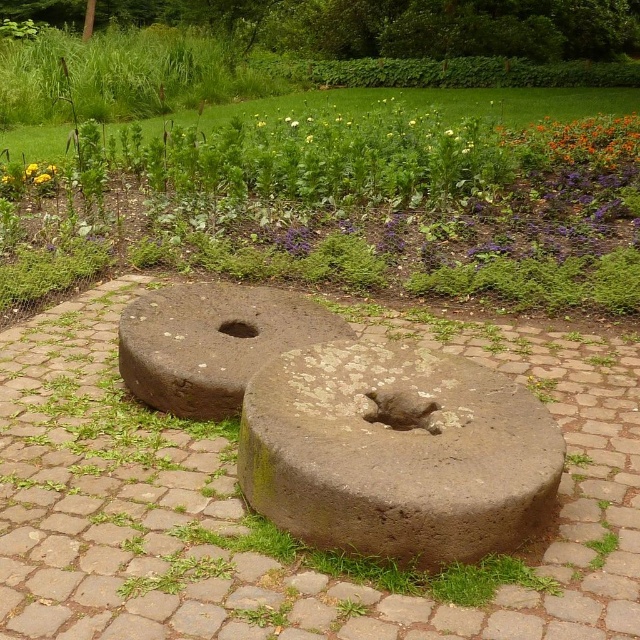
Which is in front, point (509, 163) or point (552, 452)?

Positioned in front is point (552, 452).

I want to click on green mossy stone at center, so click(x=349, y=205).

Is gray rough stone at center closer to the viewer compared to brown stone hole at center?

Yes, gray rough stone at center is in front of brown stone hole at center.

Is gray rough stone at center above brown stone hole at center?

Actually, gray rough stone at center is below brown stone hole at center.

Is point (435, 401) less distant than point (241, 321)?

Yes, it is.

You are a GUI agent. You are given a task and a screenshot of the screen. Output one action in this format:
    pyautogui.click(x=<x>, y=<y>)
    Task: Click on the gray rough stone at center
    This screenshot has height=640, width=640.
    Given the screenshot: What is the action you would take?
    pyautogui.click(x=396, y=452)

Based on the photo, is gray rough stone at center to the right of gray stone millstone at center from the viewer's perspective?

Indeed, gray rough stone at center is positioned on the right side of gray stone millstone at center.

Does gray rough stone at center have a greater height compared to gray stone millstone at center?

Yes, gray rough stone at center is taller than gray stone millstone at center.

Is point (476, 365) positioned behind point (326, 339)?

No, it is not.

This screenshot has height=640, width=640. I want to click on gray rough stone at center, so click(x=396, y=452).